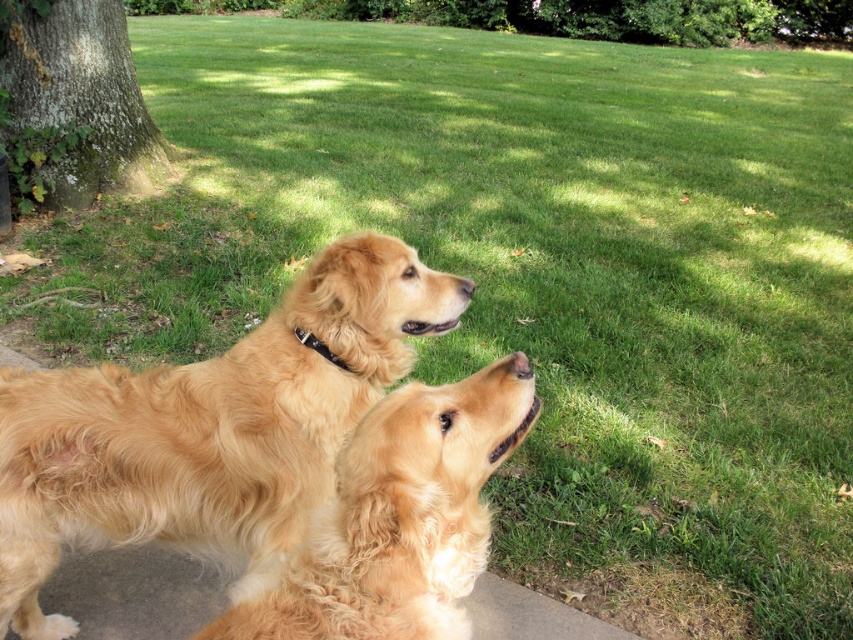
Looking at this image, you are a dog owner trying to decide if your golden fluffy dog at center can fit through a narrow path between two trees. The path is as wide as the green mossy bark at left. Can your dog pass through?

The golden fluffy dog at center is narrower than the green mossy bark at left, so it can pass through the path which is as wide as the green mossy bark at left.